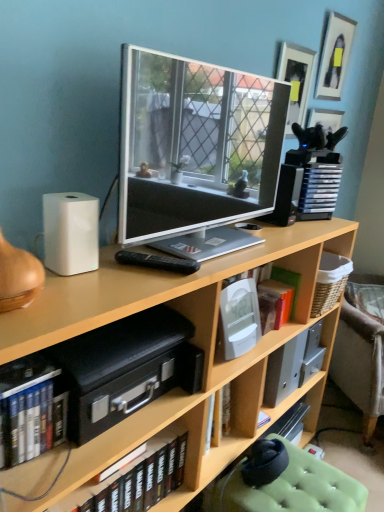
Identify the location of vacant area to the left of black plastic remote at center. This screenshot has width=384, height=512. (100, 270).